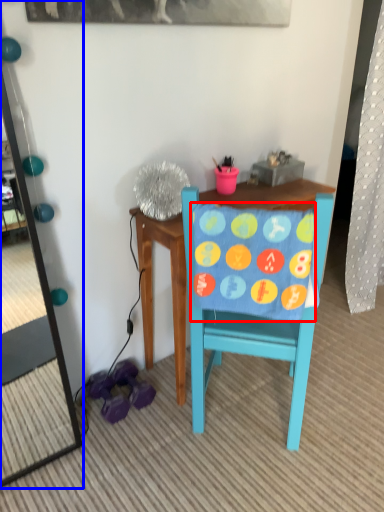
Question: Which object appears closest to the camera in this image, blanket (highlighted by a red box) or mirror (highlighted by a blue box)?

Choices:
 (A) blanket
 (B) mirror

Answer: (B)